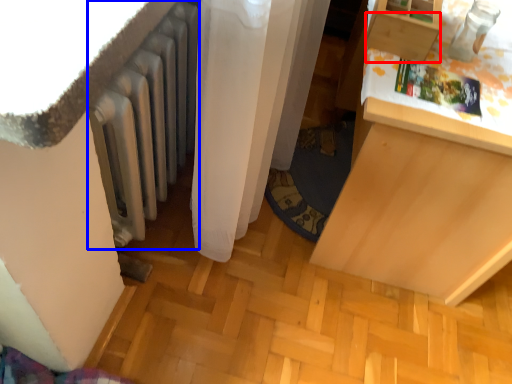
Question: Which point is further to the camera, drawer (highlighted by a red box) or radiator (highlighted by a blue box)?

Choices:
 (A) drawer
 (B) radiator

Answer: (A)